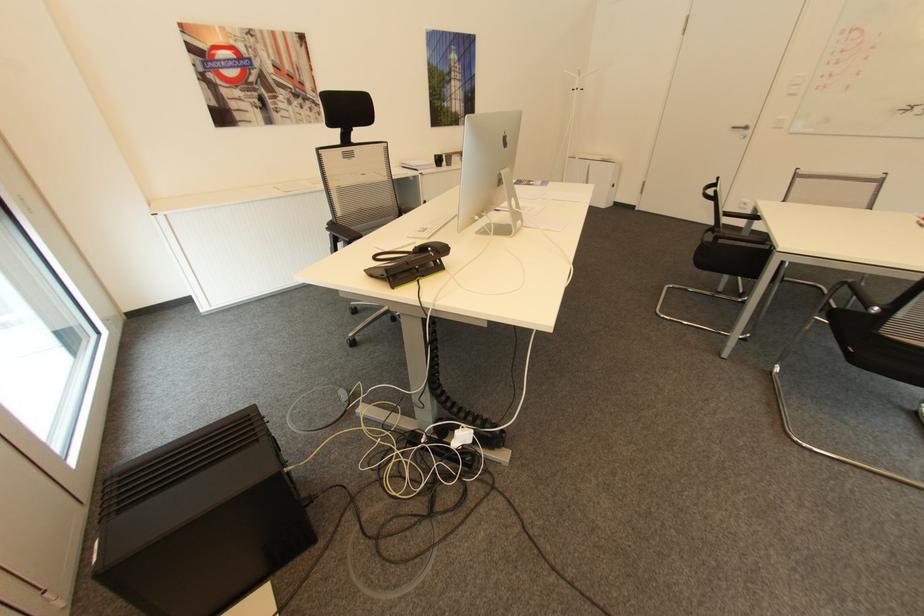
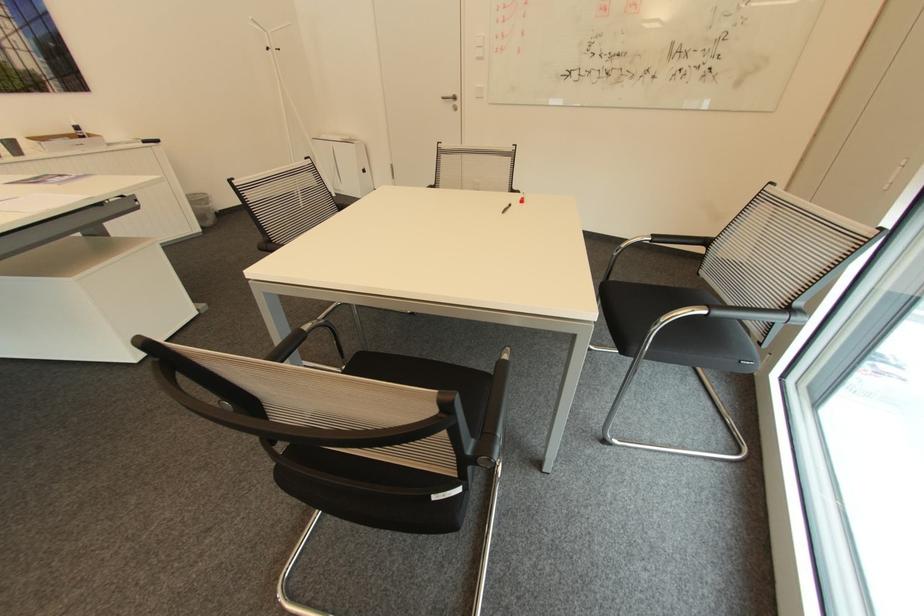
Locate, in the second image, the point that corresponds to point (821, 317) in the first image.

(347, 368)